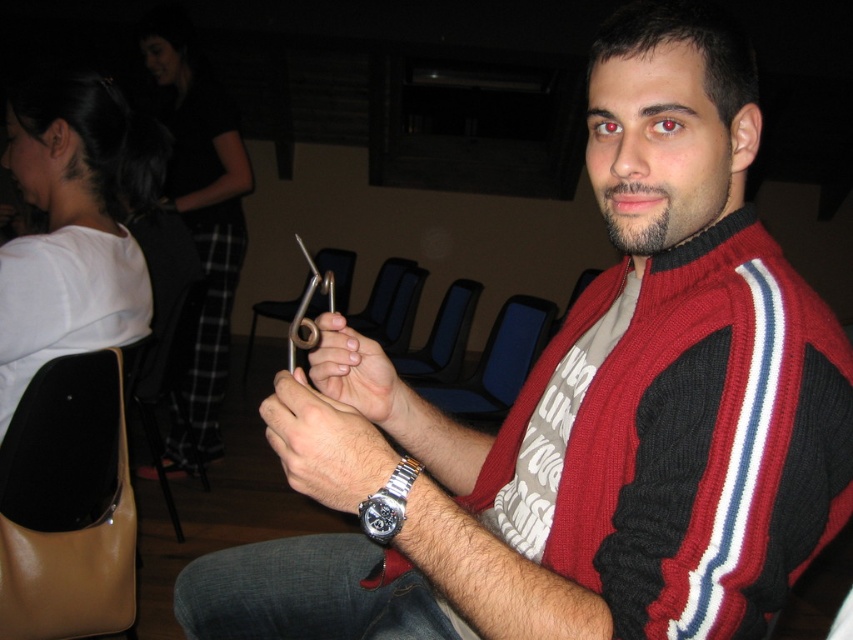
Question: Which object appears farthest from the camera in this image?

Choices:
 (A) smooth metallic scissors at center
 (B) metallic silver watch at center
 (C) silver metallic watch at center
 (D) blue fabric chair at center

Answer: (D)

Question: Which object is farther from the camera taking this photo?

Choices:
 (A) silver metallic watch at center
 (B) smooth metallic scissors at center
 (C) blue fabric chair at center
 (D) metallic silver watch at center

Answer: (C)

Question: Which point is closer to the camera?

Choices:
 (A) (271, 406)
 (B) (471, 317)

Answer: (A)

Question: Is smooth metallic scissors at center positioned behind silver metallic watch at center?

Choices:
 (A) no
 (B) yes

Answer: (B)

Question: Does blue fabric chair at center appear over black plastic chair at center?

Choices:
 (A) no
 (B) yes

Answer: (A)

Question: Is black plastic chair at center smaller than silver metallic watch at center?

Choices:
 (A) no
 (B) yes

Answer: (A)